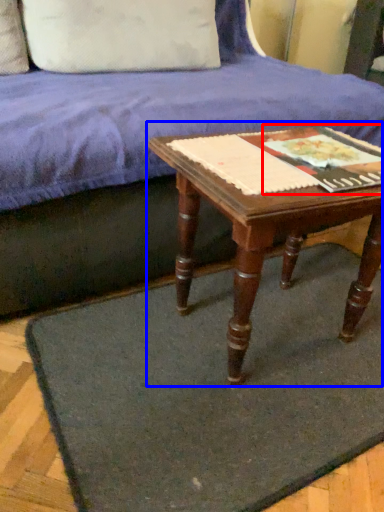
Question: Among these objects, which one is nearest to the camera, paperback book (highlighted by a red box) or table (highlighted by a blue box)?

Choices:
 (A) paperback book
 (B) table

Answer: (B)